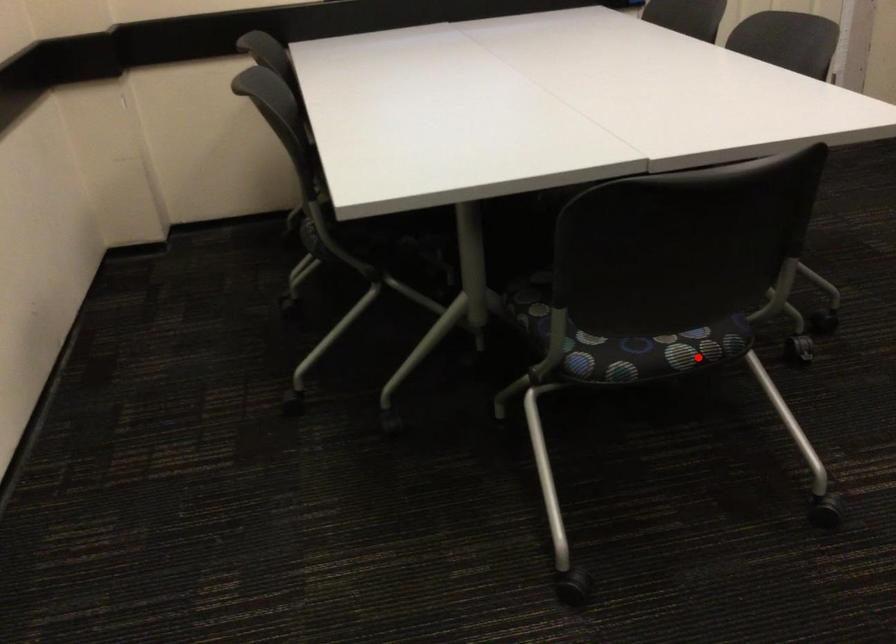
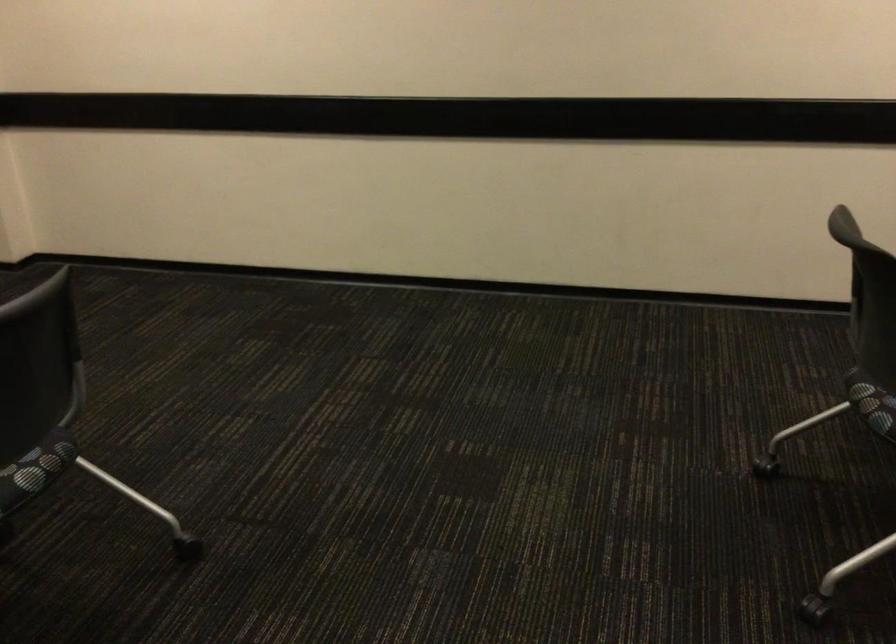
The point at the highlighted location is marked in the first image. Where is the corresponding point in the second image?

(874, 408)